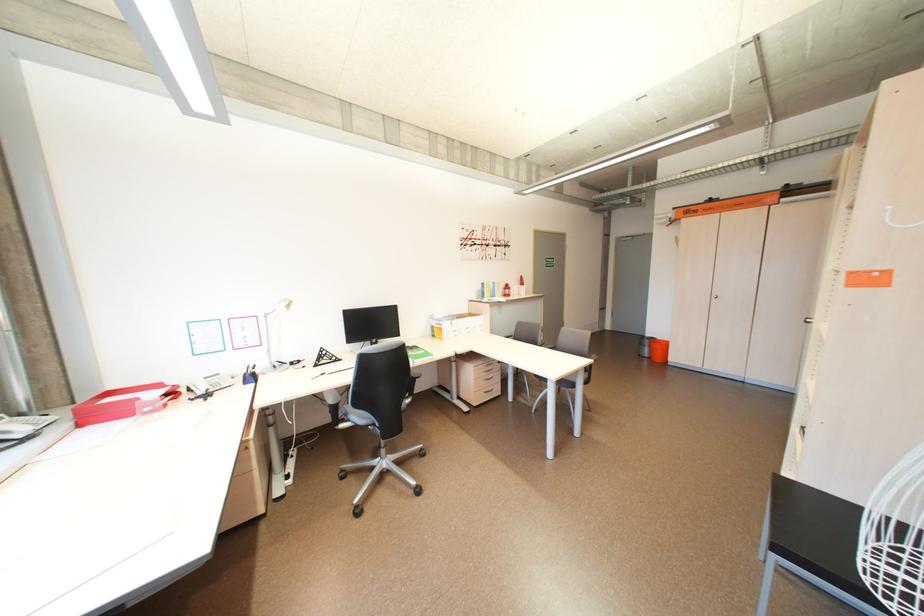
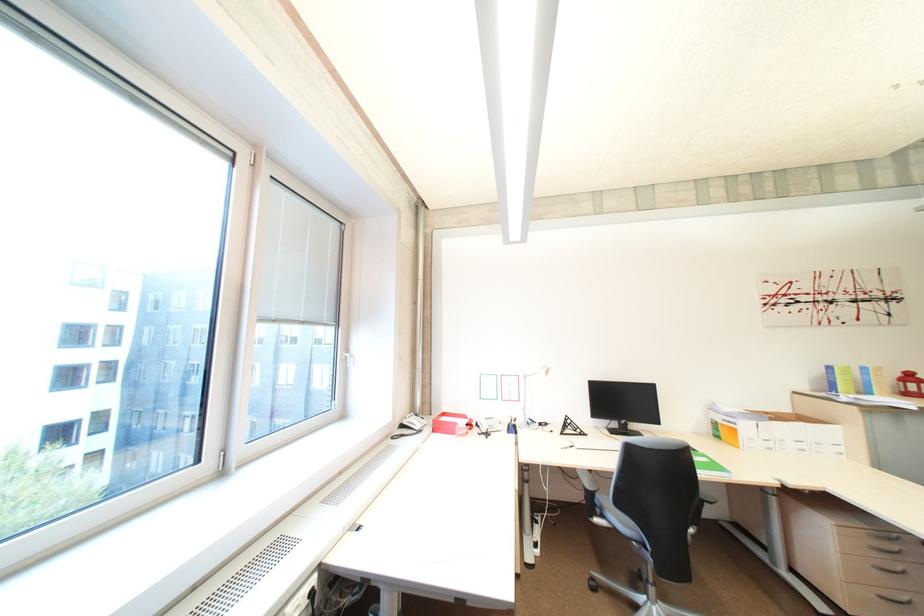
Where in the second image is the point corresponding to point 450,330 from the first image?

(745, 431)